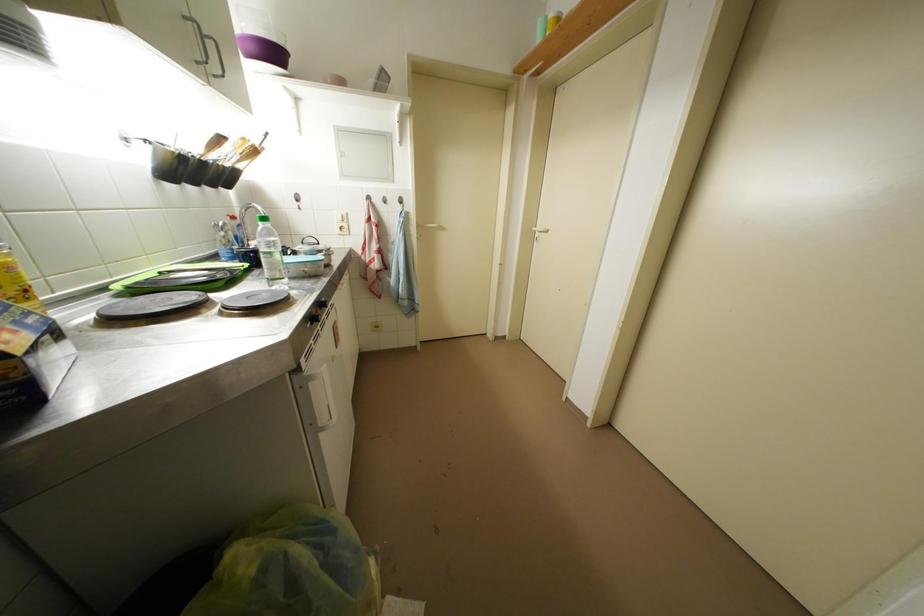
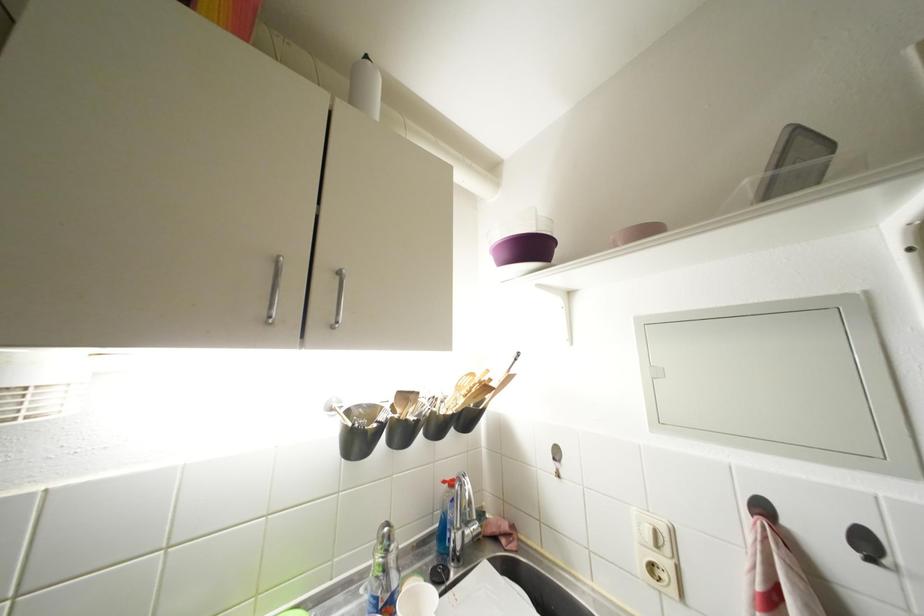
Find the pixel in the second image that matches point 392,207 in the first image.

(877, 565)